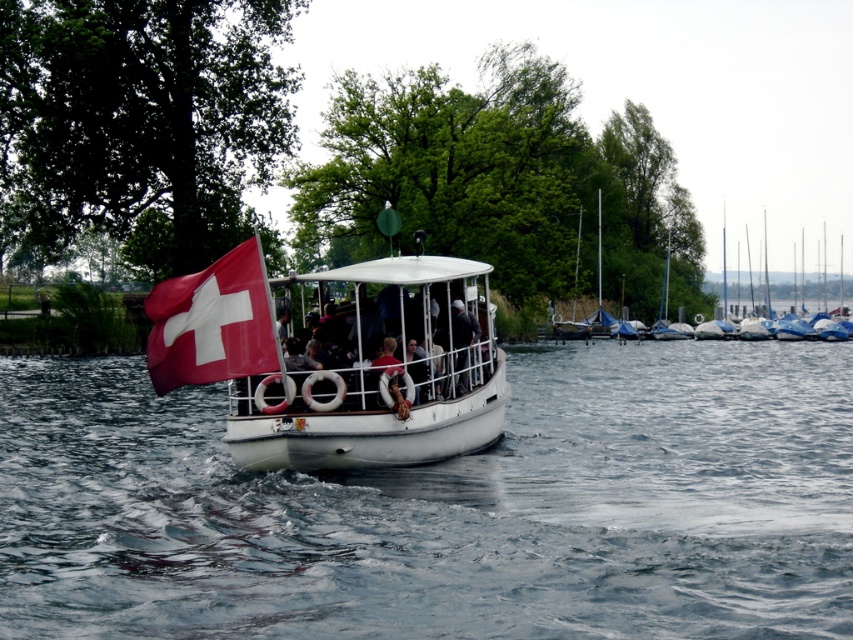
Is white smooth water at center above white matte boat at center?

Actually, white smooth water at center is below white matte boat at center.

Who is more distant from viewer, (242,593) or (436,280)?

The point (436,280) is more distant.

Locate an element on the screen. The height and width of the screenshot is (640, 853). white smooth water at center is located at coordinates (444, 508).

Does white matte boat at center come behind red matte flag at center?

Yes, it is behind red matte flag at center.

Who is more distant from viewer, (398, 376) or (206, 339)?

The point (398, 376) is behind.

Identify the location of white matte boat at center. The width and height of the screenshot is (853, 640). (331, 369).

Is white glossy sailboats at right positioned at the back of red matte flag at center?

Yes.

Does white glossy sailboats at right appear on the left side of red matte flag at center?

No, white glossy sailboats at right is not to the left of red matte flag at center.

Which is behind, point (756, 294) or point (263, 273)?

The point (756, 294) is behind.

This screenshot has height=640, width=853. I want to click on white glossy sailboats at right, so click(x=654, y=273).